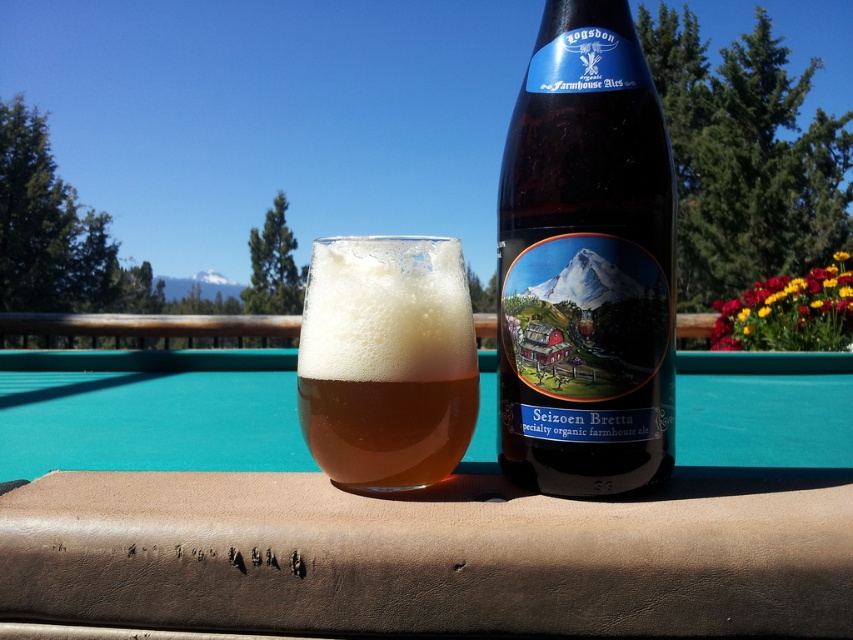
Question: Which point appears farthest from the camera in this image?

Choices:
 (A) (329, 356)
 (B) (553, 144)

Answer: (A)

Question: Which of the following is the farthest from the observer?

Choices:
 (A) (654, 445)
 (B) (766, 563)

Answer: (A)

Question: In this image, where is brown leather table at center located relative to amber glass beer at center?

Choices:
 (A) above
 (B) below

Answer: (B)

Question: Is brown leather table at center to the right of amber glass beer at center from the viewer's perspective?

Choices:
 (A) no
 (B) yes

Answer: (A)

Question: Is brown leather table at center in front of brown glass bottle at center?

Choices:
 (A) yes
 (B) no

Answer: (A)

Question: Which object is closer to the camera taking this photo?

Choices:
 (A) brown glass bottle at center
 (B) brown leather table at center

Answer: (B)